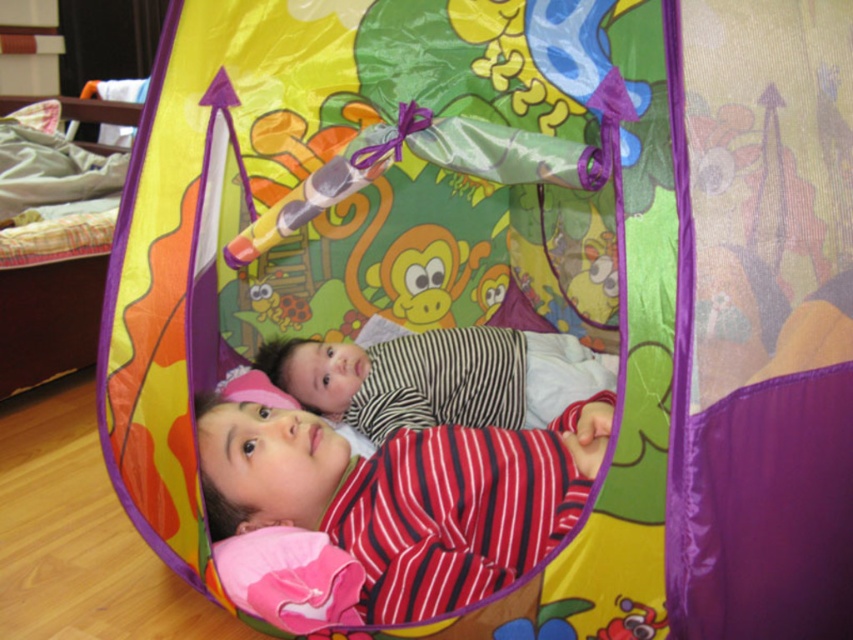
Consider the image. You are a photographer trying to capture a photo of both the striped fabric child at center and the striped fabric baby at center. Since you want to ensure both are visible, which child should you place on the left side of your frame to align with their current positions?

You should place the striped fabric child at center on the left side of your frame because they are already positioned on the left side of the striped fabric baby at center.

You are a parent trying to locate your two children inside the play tent. You see the striped fabric child at center and the striped fabric baby at center. Which one is positioned lower in the tent?

The striped fabric child at center is positioned below striped fabric baby at center, so the striped fabric child at center is lower in the tent.

You are a photographer setting up a photo shoot inside the play tent. You need to position a small stool that is 30 cm tall between the striped fabric child at center and the striped fabric baby at center. Will the stool be visible above the baby?

The striped fabric child at center is taller than the striped fabric baby at center. Since the stool is 30 cm tall, it depends on the height difference between the two children. If the baby is shorter by more than 30 cm, the stool might be visible above the baby. However, without exact height measurements, we can only confirm the relative height between the two children.